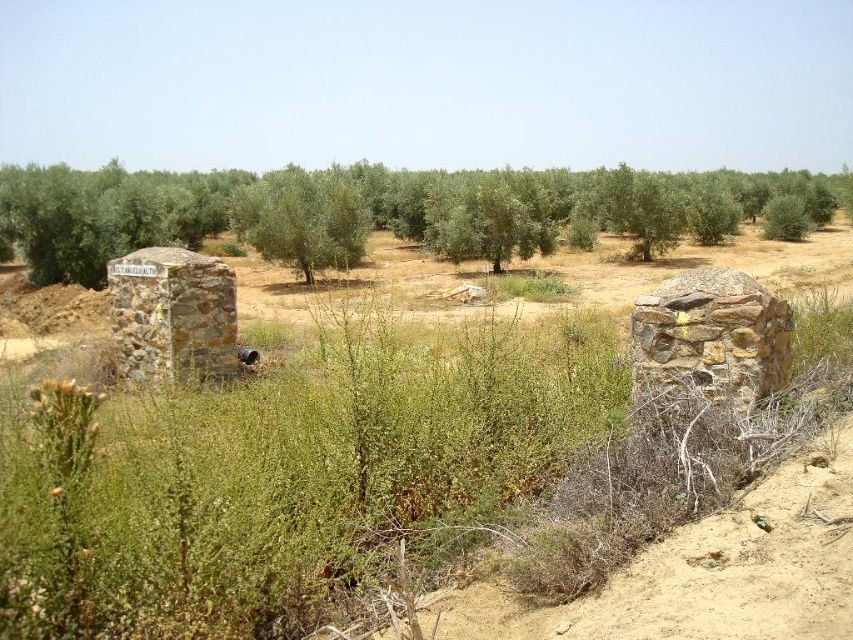
Question: Which object is farther from the camera taking this photo?

Choices:
 (A) brown rough stone at center
 (B) green leafy tree at left
 (C) green leafy tree at center

Answer: (C)

Question: Is green leafy tree at left positioned behind green leafy tree at center?

Choices:
 (A) no
 (B) yes

Answer: (A)

Question: Does green leafy tree at left appear on the left side of brown rough stone at center?

Choices:
 (A) yes
 (B) no

Answer: (A)

Question: Does green leafy tree at left have a smaller size compared to brown rough stone at center?

Choices:
 (A) yes
 (B) no

Answer: (B)

Question: Which of the following is the closest to the observer?

Choices:
 (A) green leafy tree at center
 (B) brown rough stone at center
 (C) green leafy tree at left

Answer: (B)

Question: Which of the following is the closest to the observer?

Choices:
 (A) click(x=357, y=214)
 (B) click(x=274, y=193)
 (C) click(x=643, y=333)

Answer: (C)